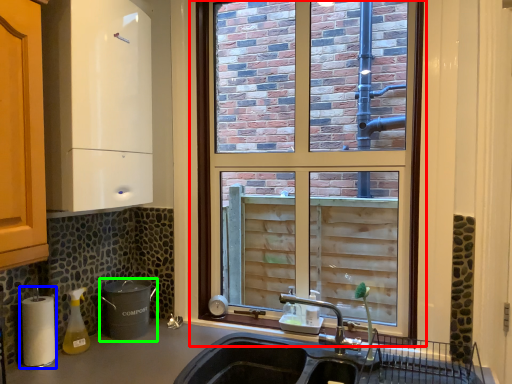
Question: Based on their relative distances, which object is nearer to window (highlighted by a red box)? Choose from appliance (highlighted by a blue box) and appliance (highlighted by a green box).

Choices:
 (A) appliance
 (B) appliance

Answer: (B)